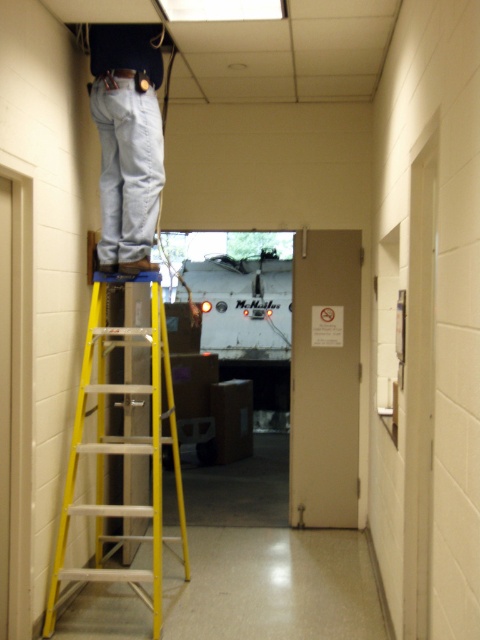
You are a maintenance worker in a building. You need to reach a light fixture that is at the point with coordinates (122, 449). You have a yellow aluminum ladder at center. Can you use the ladder to reach the light fixture?

The point (122, 449) corresponds to the yellow aluminum ladder at center, so the ladder is already positioned at the location of the light fixture. Therefore, you can use the ladder to reach the light fixture.

You are a maintenance worker needing to reach a ceiling fixture. You have a yellow aluminum ladder at center and are wearing denim pants at upper center. How far apart are the ladder and your pants?

The yellow aluminum ladder at center is 3.83 feet away from denim pants at upper center.

You are a painter who needs to reach a high ceiling area. You have a yellow aluminum ladder at center and denim pants at upper center in your view. Which object can you use to safely reach the ceiling?

The yellow aluminum ladder at center can be used to safely reach the ceiling because it has a larger size compared to the denim pants at upper center, making it more suitable for climbing and reaching heights.